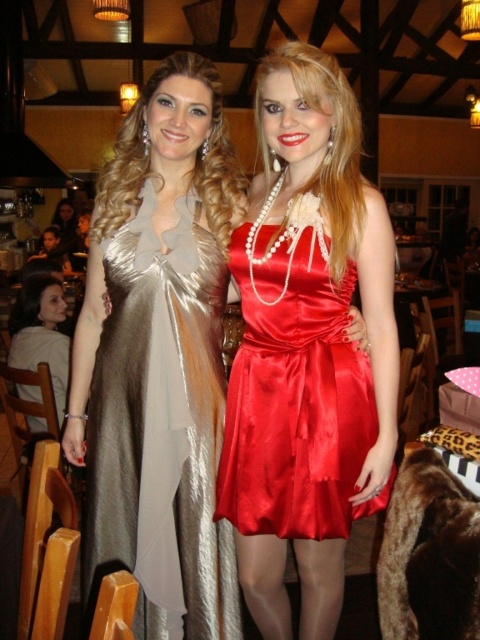
Question: Is satin metallic dress at center positioned in front of shiny red dress at center?

Choices:
 (A) no
 (B) yes

Answer: (A)

Question: Among these objects, which one is farthest from the camera?

Choices:
 (A) shiny red dress at center
 (B) satin metallic dress at center

Answer: (B)

Question: Which object appears closest to the camera in this image?

Choices:
 (A) shiny red dress at center
 (B) satin metallic dress at center

Answer: (A)

Question: Is the position of satin metallic dress at center more distant than that of shiny red dress at center?

Choices:
 (A) no
 (B) yes

Answer: (B)

Question: Is satin metallic dress at center above shiny red dress at center?

Choices:
 (A) yes
 (B) no

Answer: (B)

Question: Which point is farther to the camera?

Choices:
 (A) (298, 518)
 (B) (137, 307)

Answer: (B)